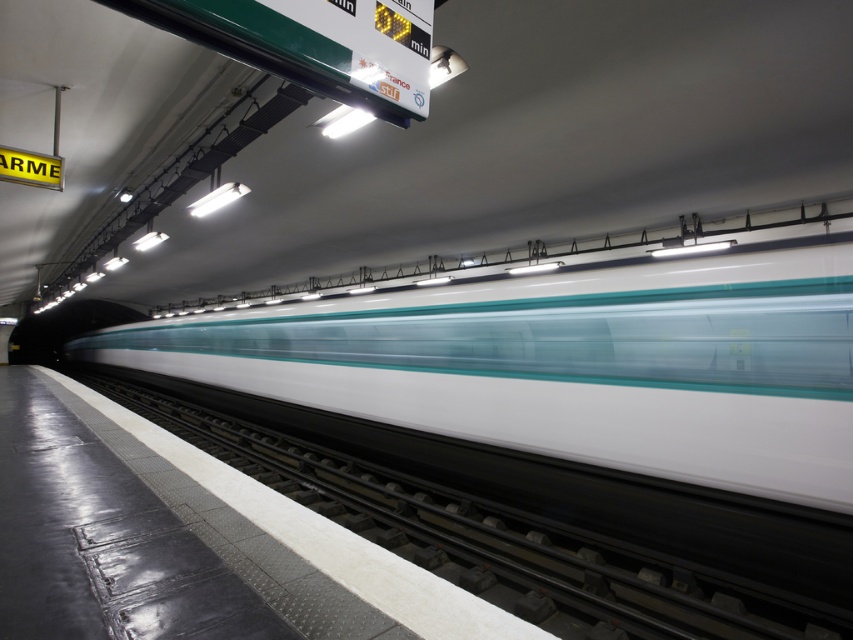
Is white glossy train at center to the left of metallic gray train track at center from the viewer's perspective?

No, white glossy train at center is not to the left of metallic gray train track at center.

Does point (347, 326) come farther from viewer compared to point (366, 472)?

Yes, point (347, 326) is behind point (366, 472).

Identify the location of white glossy train at center. This screenshot has width=853, height=640. (567, 365).

What are the coordinates of `white glossy train at center` in the screenshot? It's located at pyautogui.click(x=567, y=365).